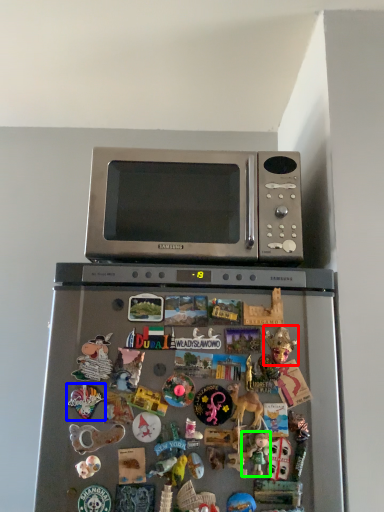
Question: Which object is positioned closest to toy (highlighted by a red box)? Select from toy (highlighted by a blue box) and toy (highlighted by a green box).

Choices:
 (A) toy
 (B) toy

Answer: (B)